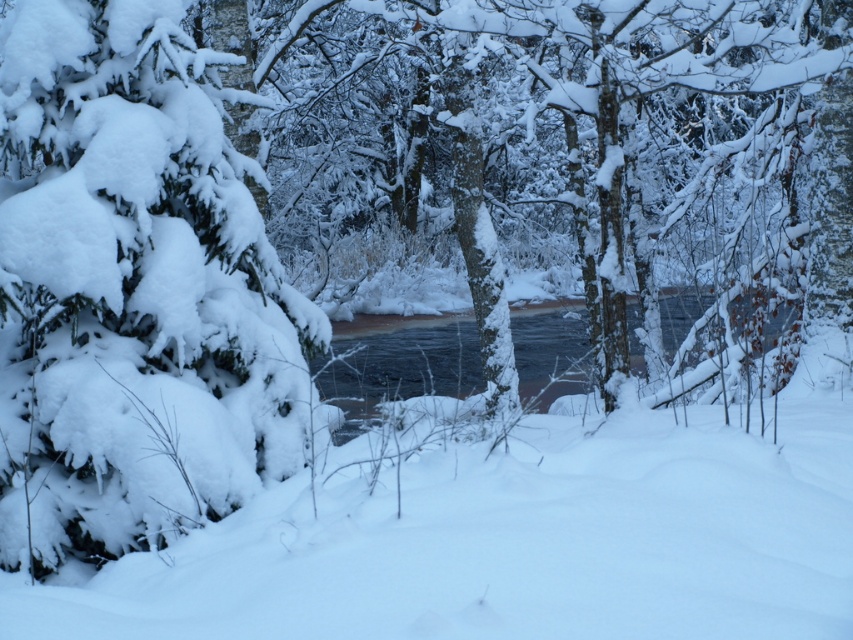
Question: Among these objects, which one is farthest from the camera?

Choices:
 (A) white fluffy snow at left
 (B) white fluffy snow at center
 (C) clear water at center

Answer: (C)

Question: Considering the real-world distances, which object is farthest from the white fluffy snow at center?

Choices:
 (A) clear water at center
 (B) white fluffy snow at left

Answer: (A)

Question: Which point is farther to the camera?

Choices:
 (A) clear water at center
 (B) white fluffy snow at center
 (C) white fluffy snow at left

Answer: (A)

Question: Can you confirm if white fluffy snow at left is positioned above clear water at center?

Choices:
 (A) no
 (B) yes

Answer: (B)

Question: From the image, what is the correct spatial relationship of white fluffy snow at center in relation to clear water at center?

Choices:
 (A) left
 (B) right

Answer: (B)

Question: From the image, what is the correct spatial relationship of white fluffy snow at center in relation to white fluffy snow at left?

Choices:
 (A) above
 (B) below

Answer: (B)